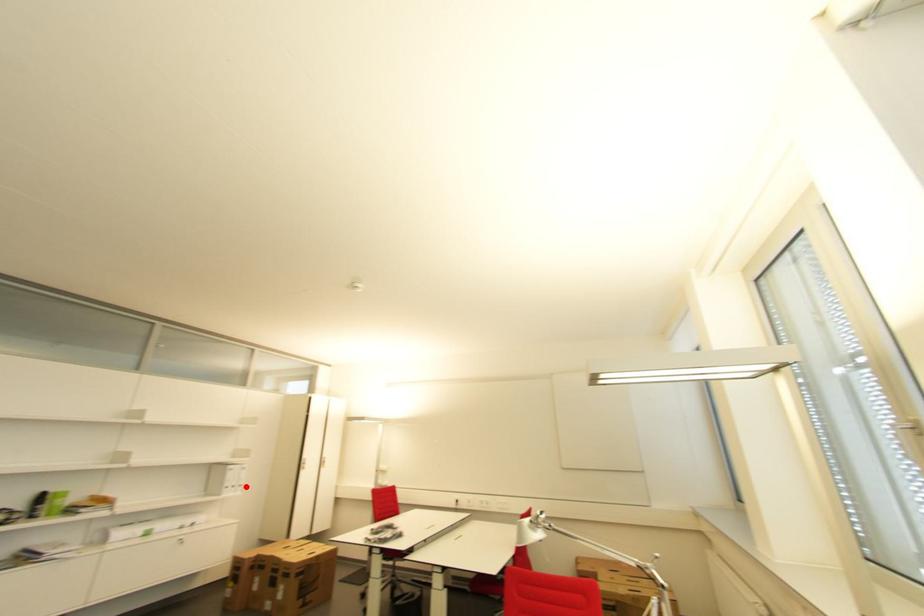
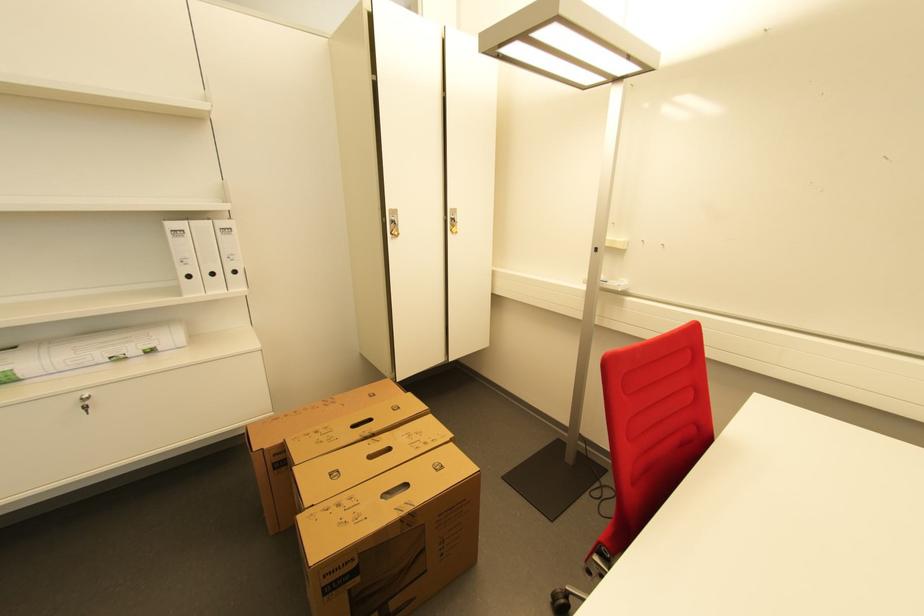
Question: I am providing you with two images of the same scene from different viewpoints. A red point is shown in image1. For the corresponding object point in image2, is it positioned nearer or farther from the camera?

Choices:
 (A) Nearer
 (B) Farther

Answer: (A)